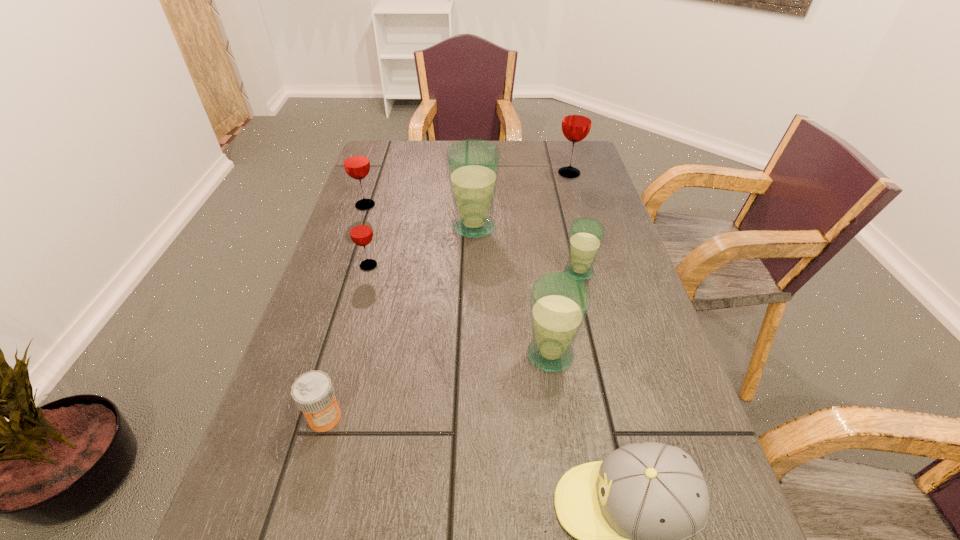
The height and width of the screenshot is (540, 960). What are the coordinates of `the smallest blue glass` in the screenshot? It's located at pyautogui.click(x=586, y=234).

Find the location of a particular element. This screenshot has height=540, width=960. the seventh farthest object is located at coordinates (313, 392).

Locate an element on the screen. The height and width of the screenshot is (540, 960). orange medicine is located at coordinates (313, 392).

Find the location of a particular element. The image size is (960, 540). free spot located on the front of the biggest red glass is located at coordinates (587, 233).

Identify the location of vacant region located on the right of the third farthest glass. This screenshot has height=540, width=960. (528, 227).

At what (x,y) coordinates should I click in order to perform the action: click on vacant space situated on the front of the fifth nearest glass. Please return your answer as a coordinate pair (x, y). This screenshot has height=540, width=960. Looking at the image, I should click on (332, 304).

Where is `free location located 0.350m on the left of the second biggest blue glass`? The height and width of the screenshot is (540, 960). free location located 0.350m on the left of the second biggest blue glass is located at coordinates (349, 355).

The height and width of the screenshot is (540, 960). Identify the location of vacant region located 0.360m on the front of the nearest red glass. (329, 406).

At what (x,y) coordinates should I click in order to perform the action: click on free space located 0.290m on the left of the second farthest blue glass. Please return your answer as a coordinate pair (x, y). Image resolution: width=960 pixels, height=540 pixels. Looking at the image, I should click on (443, 272).

At what (x,y) coordinates should I click in order to perform the action: click on vacant space located on the label side of the second nearest object. Please return your answer as a coordinate pair (x, y). The height and width of the screenshot is (540, 960). Looking at the image, I should click on (301, 500).